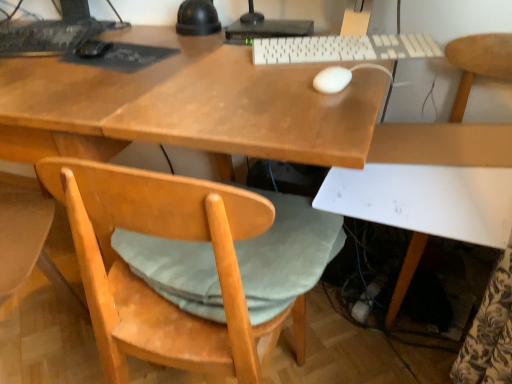
What are the coordinates of `vacant region to the right of dark gray matte mousepad at upper left` in the screenshot? It's located at (195, 52).